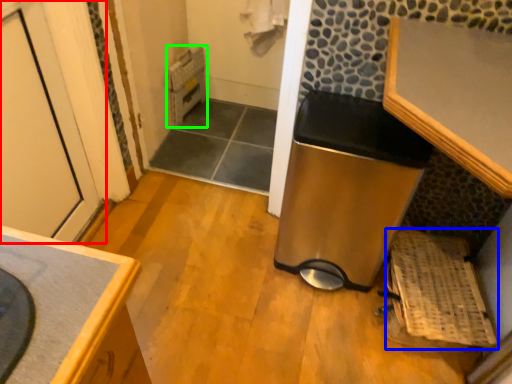
Question: Which object is positioned closest to door (highlighted by a red box)? Select from basket (highlighted by a blue box) and water heater (highlighted by a green box).

Choices:
 (A) basket
 (B) water heater

Answer: (B)